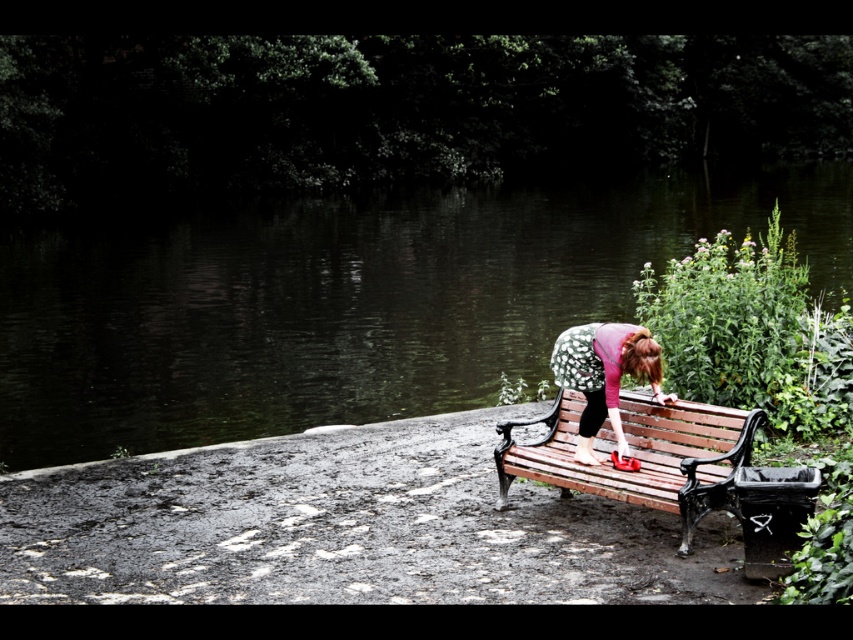
Does dark green water at center have a larger size compared to floral fabric dress at center?

Correct, dark green water at center is larger in size than floral fabric dress at center.

Find the location of a particular element. This screenshot has height=640, width=853. dark green water at center is located at coordinates (347, 301).

Can you confirm if wooden bench at center is taller than floral fabric dress at center?

No.

Which is behind, point (734, 512) or point (601, 372)?

Point (601, 372)

Is point (727, 465) behind point (636, 353)?

Yes, it is behind point (636, 353).

Find the location of a particular element. wooden bench at center is located at coordinates (640, 456).

Looking at this image, does dark green water at center have a lesser width compared to wooden bench at center?

Incorrect, dark green water at center's width is not less than wooden bench at center's.

Can you confirm if dark green water at center is taller than wooden bench at center?

Correct, dark green water at center is much taller as wooden bench at center.

Image resolution: width=853 pixels, height=640 pixels. In order to click on dark green water at center in this screenshot , I will do `click(347, 301)`.